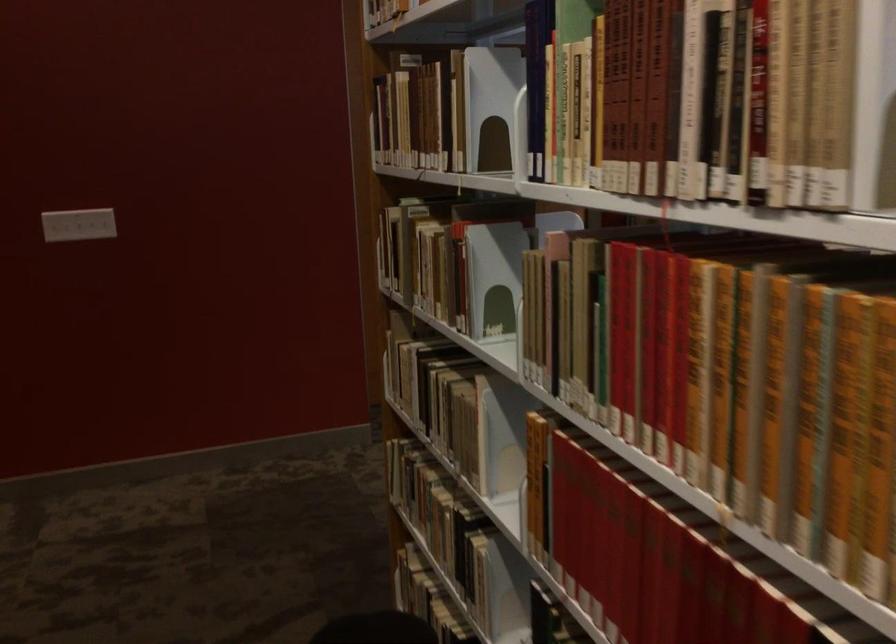
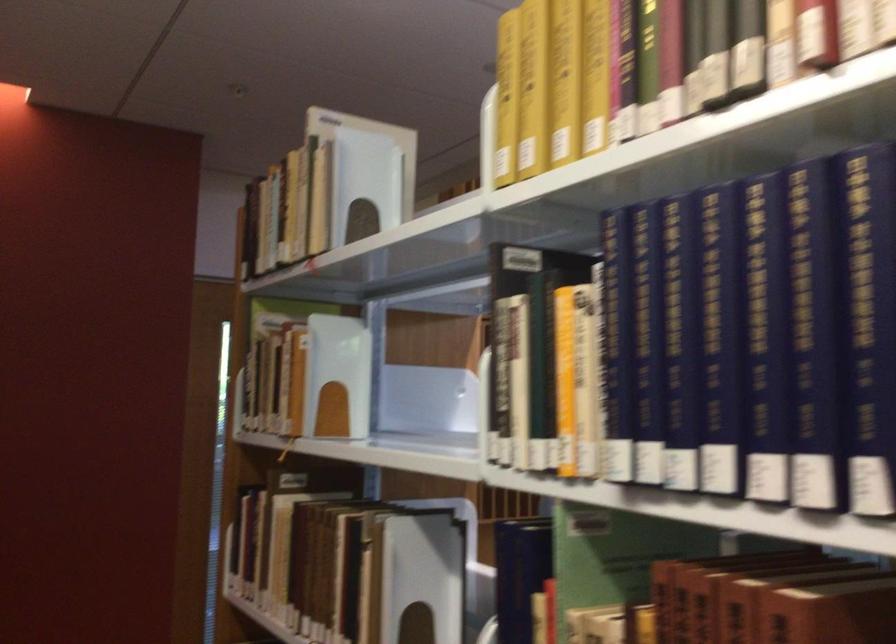
Find the pixel in the second image that matches point 495,97 in the first image.

(417, 581)